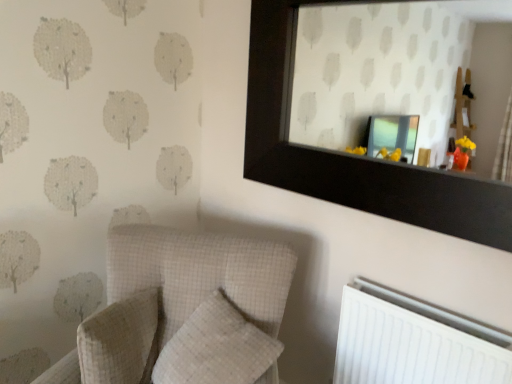
This screenshot has width=512, height=384. Describe the element at coordinates (174, 293) in the screenshot. I see `textured beige armchair at lower left` at that location.

What is the approximate width of white checkered pillow at center, the first pillow viewed from the right?

33.38 centimeters.

Image resolution: width=512 pixels, height=384 pixels. Describe the element at coordinates (216, 348) in the screenshot. I see `white checkered pillow at center, which is counted as the 2th pillow, starting from the left` at that location.

The height and width of the screenshot is (384, 512). What do you see at coordinates (120, 341) in the screenshot? I see `white checkered pillow at lower left, the 1th pillow when ordered from left to right` at bounding box center [120, 341].

I want to click on textured beige armchair at lower left, so click(174, 293).

Is textured beige armchair at lower left turned away from white checkered pillow at center, the first pillow viewed from the right?

Yes.

How many degrees apart are the facing directions of textured beige armchair at lower left and white checkered pillow at center, the first pillow viewed from the right?

38.4 degrees.

Considering the sizes of objects textured beige armchair at lower left and white checkered pillow at center, which is counted as the 2th pillow, starting from the left, in the image provided, who is smaller, textured beige armchair at lower left or white checkered pillow at center, which is counted as the 2th pillow, starting from the left,?

white checkered pillow at center, which is counted as the 2th pillow, starting from the left.

Can you confirm if textured beige armchair at lower left is wider than white checkered pillow at center, which is counted as the 2th pillow, starting from the left?

Indeed, textured beige armchair at lower left has a greater width compared to white checkered pillow at center, which is counted as the 2th pillow, starting from the left.

Is white checkered pillow at lower left, the 1th pillow when ordered from left to right, looking in the opposite direction of textured beige armchair at lower left?

Yes, textured beige armchair at lower left is at the back of white checkered pillow at lower left, the 1th pillow when ordered from left to right.

Is white checkered pillow at lower left, the second pillow in the right-to-left sequence, inside or outside of textured beige armchair at lower left?

white checkered pillow at lower left, the second pillow in the right-to-left sequence, can be found inside textured beige armchair at lower left.

Which is behind, white checkered pillow at lower left, the 1th pillow when ordered from left to right, or textured beige armchair at lower left?

white checkered pillow at lower left, the 1th pillow when ordered from left to right.

Is white checkered pillow at lower left, the second pillow in the right-to-left sequence, taller than white plastic radiator at lower right?

No.

At what (x,y) coordinates should I click in order to perform the action: click on radiator lying below the white checkered pillow at lower left, the 1th pillow when ordered from left to right (from the image's perspective). Please return your answer as a coordinate pair (x, y). Looking at the image, I should click on (414, 341).

Between white checkered pillow at lower left, the 1th pillow when ordered from left to right, and white plastic radiator at lower right, which one has larger width?

Wider between the two is white checkered pillow at lower left, the 1th pillow when ordered from left to right.

How distant is white checkered pillow at lower left, the 1th pillow when ordered from left to right, from white plastic radiator at lower right?

white checkered pillow at lower left, the 1th pillow when ordered from left to right, and white plastic radiator at lower right are 34.27 inches apart.

Is point (405, 327) closer or farther from the camera than point (409, 155)?

Point (405, 327) appears to be closer to the viewer than point (409, 155).

Is white plastic radiator at lower right touching black wooden mirror at upper center?

white plastic radiator at lower right and black wooden mirror at upper center are clearly separated.

From their relative heights in the image, would you say white plastic radiator at lower right is taller or shorter than black wooden mirror at upper center?

Clearly, white plastic radiator at lower right is shorter compared to black wooden mirror at upper center.

Is white plastic radiator at lower right completely or partially outside of black wooden mirror at upper center?

white plastic radiator at lower right is positioned outside black wooden mirror at upper center.

What's the angular difference between black wooden mirror at upper center and white checkered pillow at center, which is counted as the 2th pillow, starting from the left,'s facing directions?

They differ by 7.22 degrees in their facing directions.

Is black wooden mirror at upper center next to white checkered pillow at center, which is counted as the 2th pillow, starting from the left, and touching it?

They are not placed beside each other.

Between black wooden mirror at upper center and white checkered pillow at center, the first pillow viewed from the right, which one appears on the right side from the viewer's perspective?

Positioned to the right is black wooden mirror at upper center.

Is point (397, 81) more distant than point (184, 376)?

That is True.

Is white checkered pillow at center, the first pillow viewed from the right, facing towards white plastic radiator at lower right?

No, white checkered pillow at center, the first pillow viewed from the right, is not oriented towards white plastic radiator at lower right.

This screenshot has height=384, width=512. Identify the location of radiator on the right side of white checkered pillow at center, the first pillow viewed from the right. (414, 341).

From a real-world perspective, is white checkered pillow at center, which is counted as the 2th pillow, starting from the left, physically above white plastic radiator at lower right?

Correct, in the physical world, white checkered pillow at center, which is counted as the 2th pillow, starting from the left, is higher than white plastic radiator at lower right.

Is white checkered pillow at center, the first pillow viewed from the right, further to the viewer compared to white plastic radiator at lower right?

No, it is in front of white plastic radiator at lower right.

From the image's perspective, who appears lower, black wooden mirror at upper center or white checkered pillow at lower left, the second pillow in the right-to-left sequence?

white checkered pillow at lower left, the second pillow in the right-to-left sequence, is shown below in the image.

Do you think black wooden mirror at upper center is within white checkered pillow at lower left, the second pillow in the right-to-left sequence, or outside of it?

black wooden mirror at upper center is located beyond the bounds of white checkered pillow at lower left, the second pillow in the right-to-left sequence.

Considering the positions of objects black wooden mirror at upper center and white checkered pillow at lower left, the second pillow in the right-to-left sequence, in the image provided, who is more to the left, black wooden mirror at upper center or white checkered pillow at lower left, the second pillow in the right-to-left sequence,?

white checkered pillow at lower left, the second pillow in the right-to-left sequence, is more to the left.

Based on the photo, between black wooden mirror at upper center and white checkered pillow at lower left, the second pillow in the right-to-left sequence, which one is positioned in front?

black wooden mirror at upper center is in front.

Locate an element on the screen. furniture on the left of the white checkered pillow at center, which is counted as the 2th pillow, starting from the left is located at coordinates (174, 293).

The image size is (512, 384). I want to click on furniture located in front of the white checkered pillow at lower left, the second pillow in the right-to-left sequence, so click(174, 293).

Looking at the image, which one is located further to white checkered pillow at center, the first pillow viewed from the right, white checkered pillow at lower left, the second pillow in the right-to-left sequence, or white plastic radiator at lower right?

Based on the image, white plastic radiator at lower right appears to be further to white checkered pillow at center, the first pillow viewed from the right.

Estimate the real-world distances between objects in this image. Which object is further from textured beige armchair at lower left, white checkered pillow at center, the first pillow viewed from the right, or white plastic radiator at lower right?

white plastic radiator at lower right is further to textured beige armchair at lower left.

Which object lies further to the anchor point white checkered pillow at lower left, the 1th pillow when ordered from left to right, white plastic radiator at lower right or white checkered pillow at center, which is counted as the 2th pillow, starting from the left?

white plastic radiator at lower right is further to white checkered pillow at lower left, the 1th pillow when ordered from left to right.

Which object lies further to the anchor point white plastic radiator at lower right, white checkered pillow at center, the first pillow viewed from the right, or textured beige armchair at lower left?

Among the two, textured beige armchair at lower left is located further to white plastic radiator at lower right.

Estimate the real-world distances between objects in this image. Which object is closer to black wooden mirror at upper center, white plastic radiator at lower right or textured beige armchair at lower left?

Based on the image, white plastic radiator at lower right appears to be nearer to black wooden mirror at upper center.

Estimate the real-world distances between objects in this image. Which object is closer to black wooden mirror at upper center, white plastic radiator at lower right or white checkered pillow at lower left, the second pillow in the right-to-left sequence?

white plastic radiator at lower right is positioned closer to the anchor black wooden mirror at upper center.

Estimate the real-world distances between objects in this image. Which object is closer to white checkered pillow at lower left, the 1th pillow when ordered from left to right, textured beige armchair at lower left or white plastic radiator at lower right?

Among the two, textured beige armchair at lower left is located nearer to white checkered pillow at lower left, the 1th pillow when ordered from left to right.

Which object lies nearer to the anchor point textured beige armchair at lower left, white checkered pillow at center, the first pillow viewed from the right, or white checkered pillow at lower left, the second pillow in the right-to-left sequence?

white checkered pillow at lower left, the second pillow in the right-to-left sequence, lies closer to textured beige armchair at lower left than the other object.

The height and width of the screenshot is (384, 512). What are the coordinates of `pillow between white checkered pillow at lower left, the 1th pillow when ordered from left to right, and white plastic radiator at lower right from left to right` in the screenshot? It's located at (216, 348).

This screenshot has height=384, width=512. Find the location of `pillow between textured beige armchair at lower left and white checkered pillow at lower left, the second pillow in the right-to-left sequence, from front to back`. pillow between textured beige armchair at lower left and white checkered pillow at lower left, the second pillow in the right-to-left sequence, from front to back is located at coordinates (216, 348).

Locate an element on the screen. This screenshot has height=384, width=512. pillow between black wooden mirror at upper center and white checkered pillow at center, the first pillow viewed from the right, in the up-down direction is located at coordinates (120, 341).

Find the location of `mirror between white checkered pillow at lower left, the 1th pillow when ordered from left to right, and white plastic radiator at lower right`. mirror between white checkered pillow at lower left, the 1th pillow when ordered from left to right, and white plastic radiator at lower right is located at coordinates (399, 72).